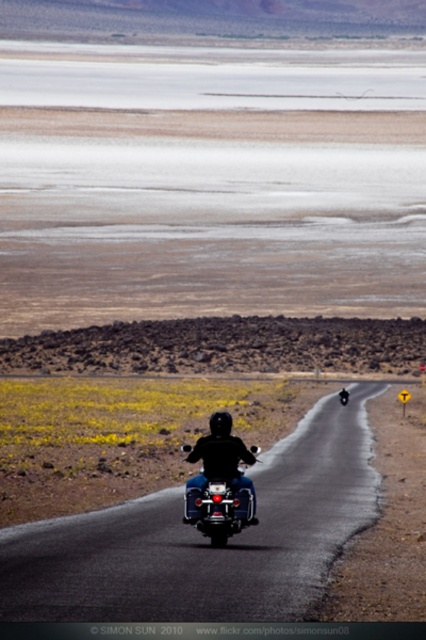
Question: Is black rubber motorcycle at center closer to the viewer compared to shiny chrome motorcycle at center?

Choices:
 (A) no
 (B) yes

Answer: (B)

Question: Does black rubber motorcycle at center lie behind shiny chrome motorcycle at center?

Choices:
 (A) yes
 (B) no

Answer: (B)

Question: Which object appears farthest from the camera in this image?

Choices:
 (A) shiny chrome motorcycle at center
 (B) black rubber motorcycle at center

Answer: (A)

Question: Can you confirm if black rubber motorcycle at center is positioned to the right of shiny chrome motorcycle at center?

Choices:
 (A) yes
 (B) no

Answer: (A)

Question: Which point appears closest to the camera in this image?

Choices:
 (A) (108, 620)
 (B) (226, 476)

Answer: (A)

Question: Which point appears farthest from the camera in this image?

Choices:
 (A) (100, 532)
 (B) (189, 522)

Answer: (A)